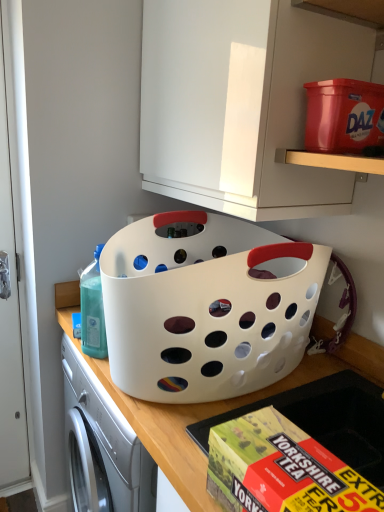
Question: From a real-world perspective, is yellow cardboard box at lower center under matte plastic storage box at upper right?

Choices:
 (A) yes
 (B) no

Answer: (A)

Question: From a real-world perspective, is yellow cardboard box at lower center positioned over matte plastic storage box at upper right based on gravity?

Choices:
 (A) yes
 (B) no

Answer: (B)

Question: Considering the relative positions of yellow cardboard box at lower center and matte plastic storage box at upper right in the image provided, is yellow cardboard box at lower center to the left of matte plastic storage box at upper right from the viewer's perspective?

Choices:
 (A) yes
 (B) no

Answer: (A)

Question: From the image's perspective, would you say yellow cardboard box at lower center is shown under matte plastic storage box at upper right?

Choices:
 (A) no
 (B) yes

Answer: (B)

Question: Does yellow cardboard box at lower center have a lesser width compared to matte plastic storage box at upper right?

Choices:
 (A) yes
 (B) no

Answer: (A)

Question: Is matte plastic storage box at upper right wider or thinner than yellow cardboard box at lower center?

Choices:
 (A) thin
 (B) wide

Answer: (B)

Question: From a real-world perspective, relative to yellow cardboard box at lower center, is matte plastic storage box at upper right vertically above or below?

Choices:
 (A) above
 (B) below

Answer: (A)

Question: Is matte plastic storage box at upper right inside the boundaries of yellow cardboard box at lower center, or outside?

Choices:
 (A) outside
 (B) inside

Answer: (A)

Question: From their relative heights in the image, would you say matte plastic storage box at upper right is taller or shorter than yellow cardboard box at lower center?

Choices:
 (A) tall
 (B) short

Answer: (A)

Question: Looking at the image, does white plastic basket at center seem bigger or smaller compared to matte plastic storage box at upper right?

Choices:
 (A) big
 (B) small

Answer: (A)

Question: In the image, is white plastic basket at center on the left side or the right side of matte plastic storage box at upper right?

Choices:
 (A) right
 (B) left

Answer: (B)

Question: Does point coord(74,294) appear closer or farther from the camera than point coord(332,108)?

Choices:
 (A) closer
 (B) farther

Answer: (B)

Question: From a real-world perspective, is white plastic basket at center physically located above or below matte plastic storage box at upper right?

Choices:
 (A) above
 (B) below

Answer: (B)

Question: From the image's perspective, relative to translucent plastic bottle at left, is white glossy cabinet at upper center above or below?

Choices:
 (A) above
 (B) below

Answer: (A)

Question: In terms of size, does white glossy cabinet at upper center appear bigger or smaller than translucent plastic bottle at left?

Choices:
 (A) small
 (B) big

Answer: (B)